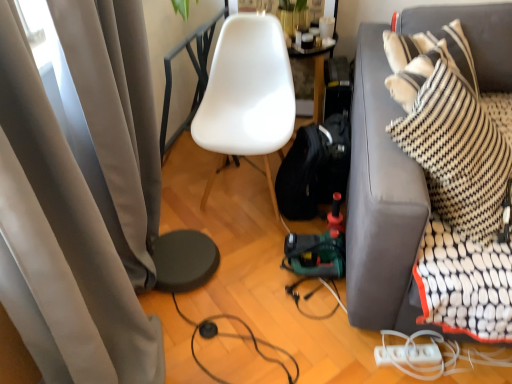
At what (x,y) coordinates should I click in order to perform the action: click on free space below black rubber cable at lower center, the second cable viewed from the right (from a real-world perspective). Please return your answer as a coordinate pair (x, y). Looking at the image, I should click on (247, 362).